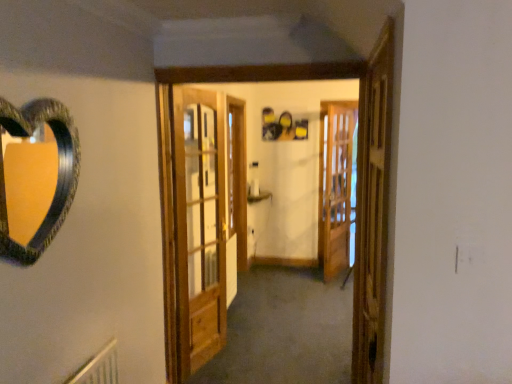
Question: From a real-world perspective, is wooden screen door at right, the 2th screen door from the right, above or below wooden door at center?

Choices:
 (A) below
 (B) above

Answer: (B)

Question: In the image, is wooden screen door at right, the 2th screen door from the right, positioned in front of or behind wooden door at center?

Choices:
 (A) front
 (B) behind

Answer: (A)

Question: Estimate the real-world distances between objects in this image. Which object is farther from the wooden screen door at center, which is the 1th screen door in right-to-left order?

Choices:
 (A) wooden door at center
 (B) wooden screen door at right, which is the second screen door from back to front
 (C) wooden barn door at center

Answer: (B)

Question: Based on their relative distances, which object is farther from the wooden barn door at center?

Choices:
 (A) wooden screen door at right, positioned as the 1th screen door in front-to-back order
 (B) wooden door at center
 (C) wooden screen door at center, the first screen door positioned from the back

Answer: (C)